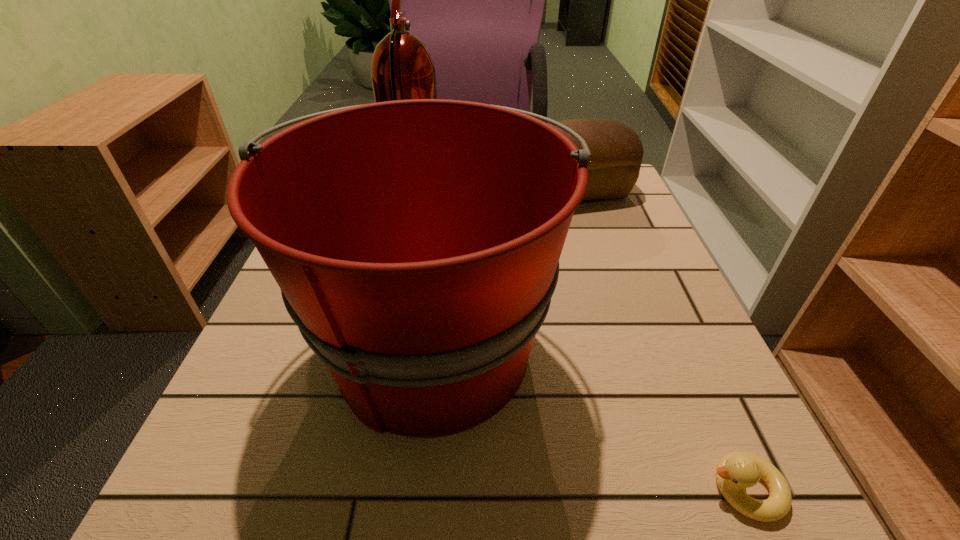
Find the location of a particular element. The height and width of the screenshot is (540, 960). fire extinguisher at the far edge is located at coordinates (402, 68).

You are a GUI agent. You are given a task and a screenshot of the screen. Output one action in this format:
    pyautogui.click(x=<x>, y=<y>)
    Task: Click on the bread that is at the far edge
    Image resolution: width=960 pixels, height=540 pixels.
    Given the screenshot: What is the action you would take?
    pyautogui.click(x=616, y=150)

The width and height of the screenshot is (960, 540). I want to click on bucket that is at the near edge, so click(416, 243).

Identify the location of duckling located in the near edge section of the desktop. (736, 471).

You are a GUI agent. You are given a task and a screenshot of the screen. Output one action in this format:
    pyautogui.click(x=<x>, y=<y>)
    Task: Click on the fire extinguisher at the left edge
    The height and width of the screenshot is (540, 960).
    Given the screenshot: What is the action you would take?
    pyautogui.click(x=402, y=68)

Where is `bucket that is at the left edge`? The width and height of the screenshot is (960, 540). bucket that is at the left edge is located at coordinates (416, 243).

You are a GUI agent. You are given a task and a screenshot of the screen. Output one action in this format:
    pyautogui.click(x=<x>, y=<y>)
    Task: Click on the bread that is positioned at the right edge
    The height and width of the screenshot is (540, 960).
    Given the screenshot: What is the action you would take?
    pyautogui.click(x=616, y=150)

At what (x,y) coordinates should I click in order to perform the action: click on duckling at the right edge. Please return your answer as a coordinate pair (x, y). This screenshot has width=960, height=540. Looking at the image, I should click on (736, 471).

Where is `object that is positioned at the far left corner`? object that is positioned at the far left corner is located at coordinates tap(402, 68).

Where is `object that is at the near left corner`? The width and height of the screenshot is (960, 540). object that is at the near left corner is located at coordinates (416, 243).